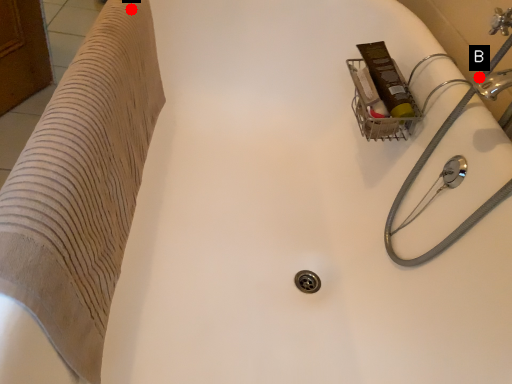
Question: Two points are circled on the image, labeled by A and B beside each circle. Which point is closer to the camera?

Choices:
 (A) A is closer
 (B) B is closer

Answer: (A)